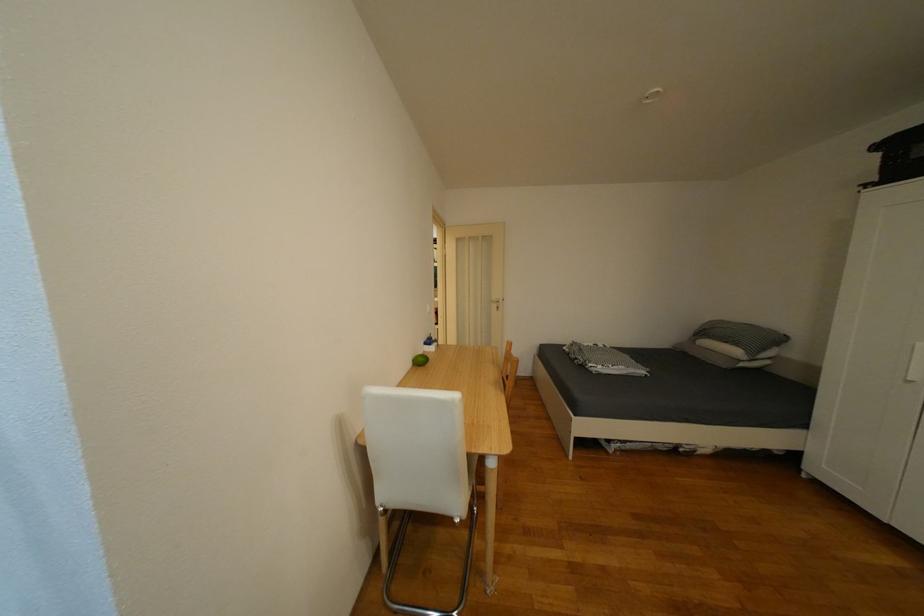
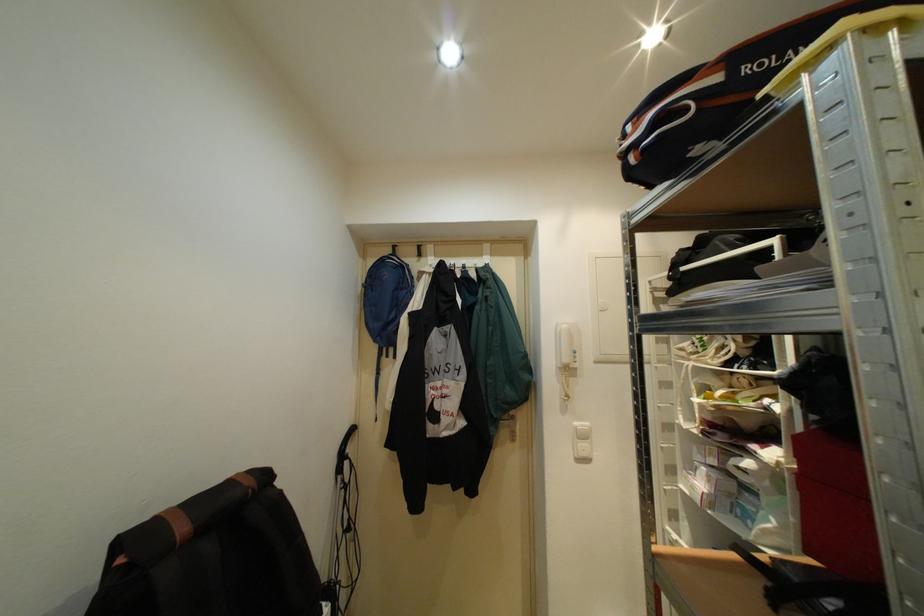
Question: The images are taken continuously from a first-person perspective. In which direction are you moving?

Choices:
 (A) Left
 (B) Right
 (C) Forward
 (D) Backward

Answer: (C)